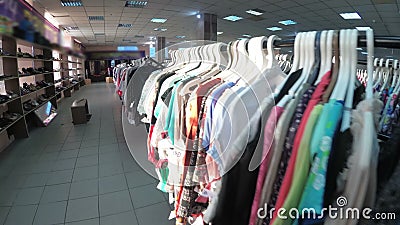
The image size is (400, 225). Find the location of `pillar`. pillar is located at coordinates (209, 31), (160, 44).